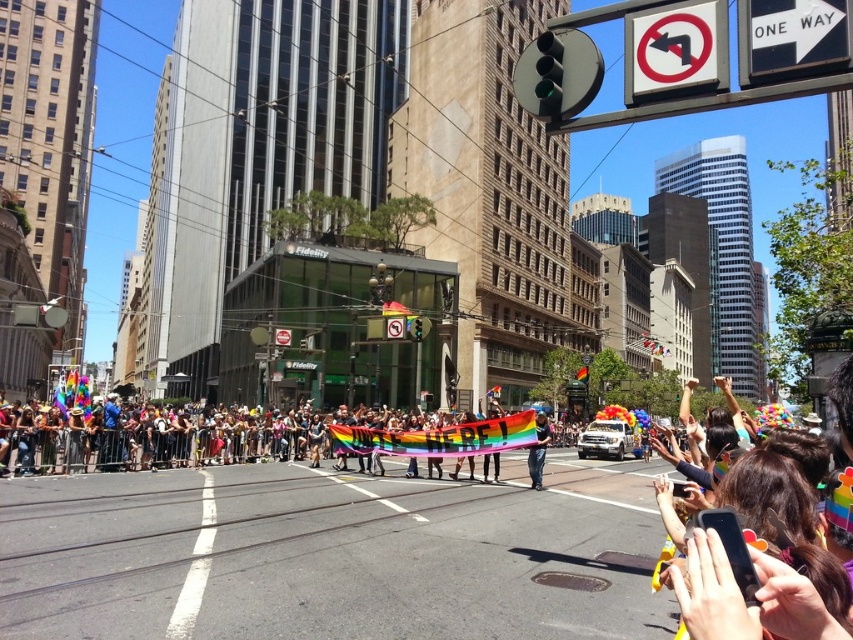
You are a photographer at the Pride parade. You want to capture a photo that includes both the rainbow fabric banner at center and the rainbow flag at center. Which object should you focus on first to ensure both fit in the frame?

The rainbow fabric banner at center is larger in size than the rainbow flag at center, so you should focus on the larger banner first to ensure both fit in the frame.